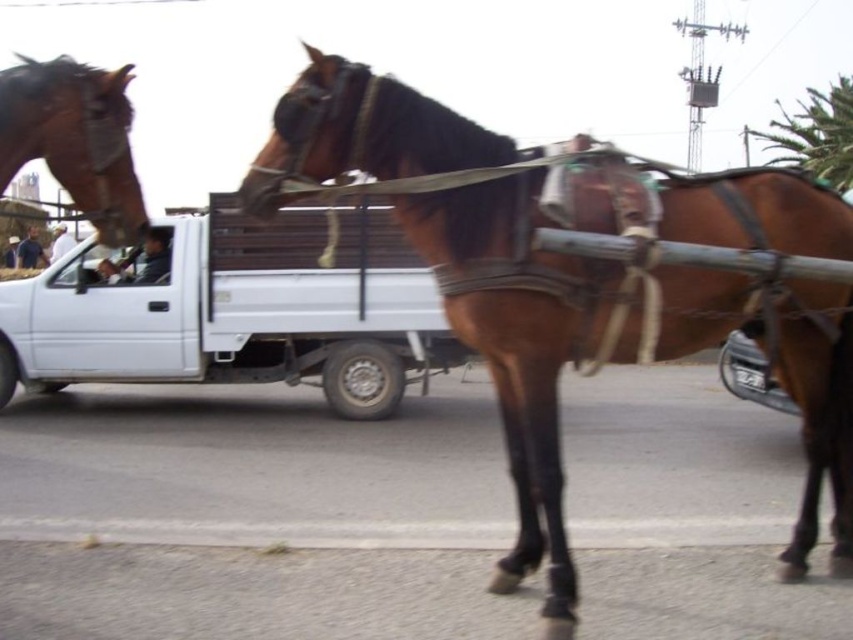
Can you confirm if brown glossy horse at center is positioned to the right of white matte truck at center?

Yes, brown glossy horse at center is to the right of white matte truck at center.

Where is `brown glossy horse at center`? brown glossy horse at center is located at coordinates (587, 276).

I want to click on brown glossy horse at center, so click(587, 276).

Consider the image. Does white matte truck at center have a lesser height compared to brown glossy horse at upper left?

No, white matte truck at center is not shorter than brown glossy horse at upper left.

Is point (264, 260) positioned after point (47, 77)?

Yes, it is.

Image resolution: width=853 pixels, height=640 pixels. Find the location of `white matte truck at center`. white matte truck at center is located at coordinates (238, 310).

Can you confirm if brown glossy horse at center is shorter than brown glossy horse at upper left?

Incorrect, brown glossy horse at center's height does not fall short of brown glossy horse at upper left's.

Who is higher up, brown glossy horse at center or brown glossy horse at upper left?

Positioned higher is brown glossy horse at upper left.

Is point (639, 250) behind point (73, 120)?

That is True.

At what (x,y) coordinates should I click in order to perform the action: click on brown glossy horse at center. Please return your answer as a coordinate pair (x, y). Looking at the image, I should click on (587, 276).